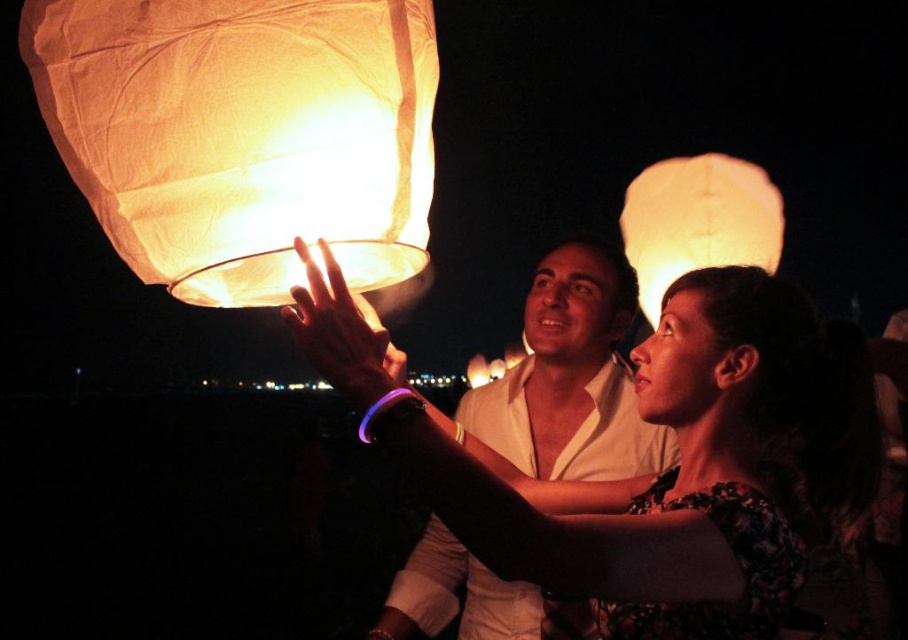
Based on the photo, you are a photographer capturing the scene of two people releasing sky lanterns. You notice the matte white shirt at center and the matte white lantern at upper right. Which object is closer to the camera based on their positions?

The matte white shirt at center is closer to the camera because it is shorter than the matte white lantern at upper right, indicating it is positioned in front.

You are an observer standing in front of the scene. You see the matte white shirt at center and the matte white lantern at upper right. Which object is closer to the bottom of the image?

The matte white shirt at center is positioned under the matte white lantern at upper right, meaning it is closer to the bottom of the image.